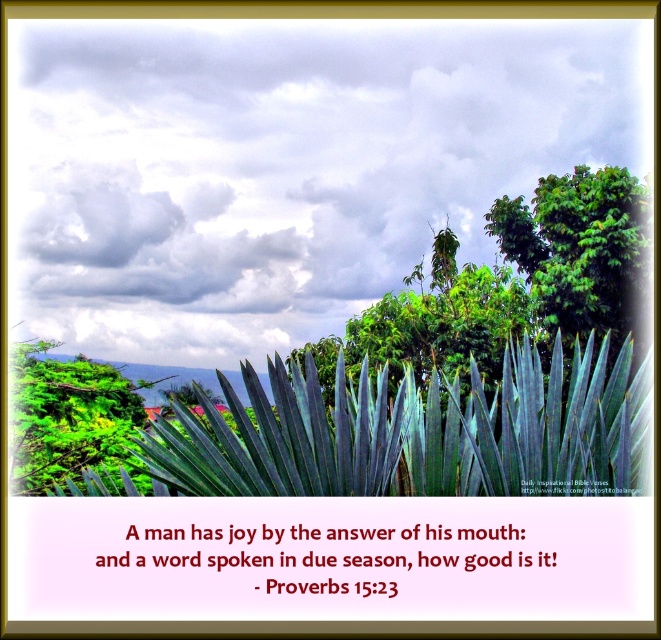
Is point (186, 179) farther from camera compared to point (563, 189)?

That is True.

Who is positioned more to the right, cloudy sky at upper center or green leafy tree at upper right?

From the viewer's perspective, green leafy tree at upper right appears more on the right side.

Is point (377, 74) positioned in front of point (625, 288)?

That is False.

In order to click on cloudy sky at upper center in this screenshot , I will do `click(284, 164)`.

Consider the image. Who is taller, cloudy sky at upper center or blue-green leafy plant at center?

cloudy sky at upper center

Is cloudy sky at upper center thinner than blue-green leafy plant at center?

No, cloudy sky at upper center is not thinner than blue-green leafy plant at center.

Find the location of `cloudy sky at upper center`. cloudy sky at upper center is located at coordinates (284, 164).

Can you confirm if blue-green leafy plant at center is wider than green leafy tree at upper right?

No.

Who is higher up, blue-green leafy plant at center or green leafy tree at upper right?

green leafy tree at upper right is higher up.

Where is `blue-green leafy plant at center`? blue-green leafy plant at center is located at coordinates (414, 433).